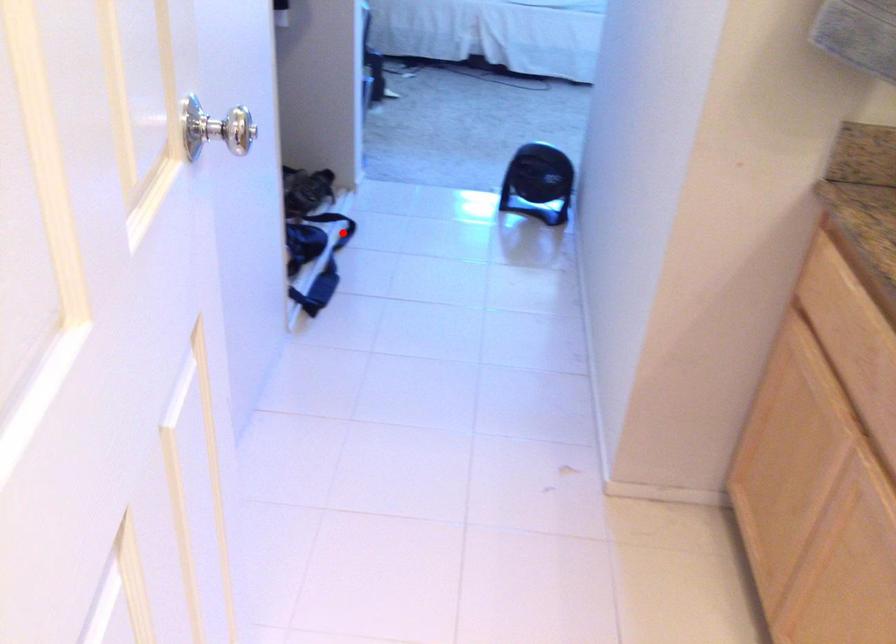
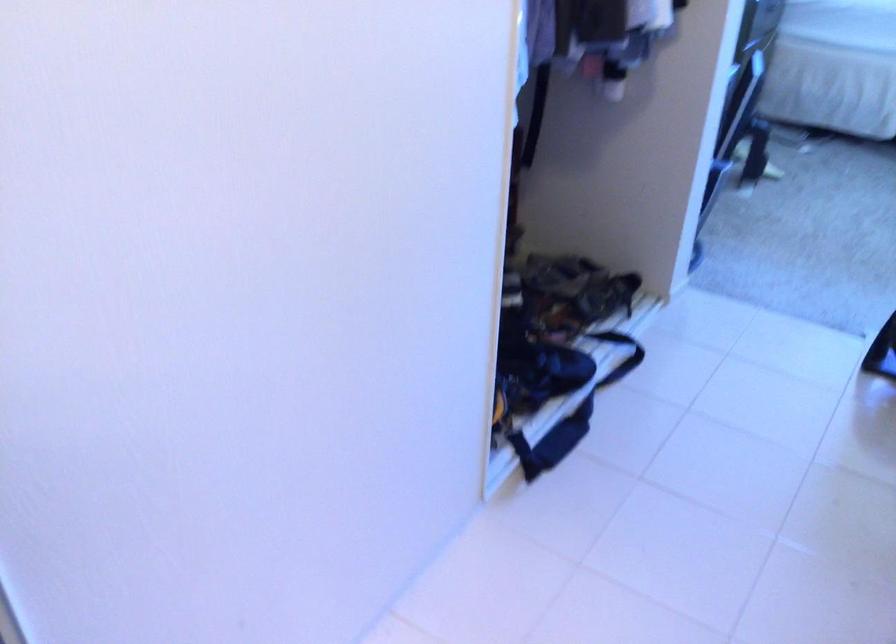
Question: I am providing you with two images of the same scene from different viewpoints. A red point is shown in image1. For the corresponding object point in image2, is it positioned nearer or farther from the camera?

Choices:
 (A) Nearer
 (B) Farther

Answer: (A)